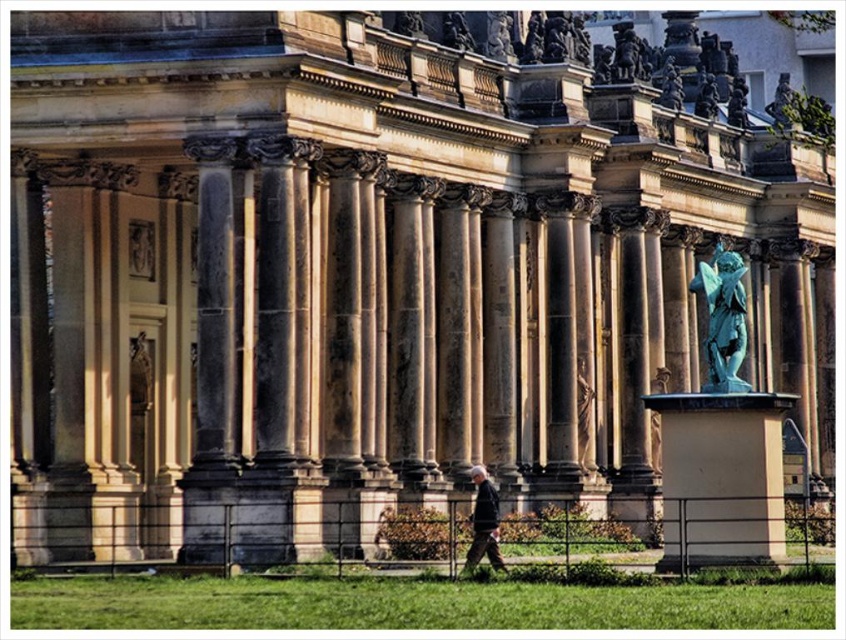
Question: Can you confirm if green patina statue at center-right is positioned to the left of smooth beige statue at center?

Choices:
 (A) no
 (B) yes

Answer: (A)

Question: Considering the real-world distances, which object is closest to the smooth beige statue at center?

Choices:
 (A) green patina statue at upper right
 (B) dark gray fabric jacket at center

Answer: (B)

Question: Is dark gray fabric jacket at center thinner than smooth beige statue at center?

Choices:
 (A) yes
 (B) no

Answer: (B)

Question: Which of the following is the farthest from the observer?

Choices:
 (A) smooth beige statue at center
 (B) dark gray fabric jacket at center
 (C) green patina statue at center-right
 (D) green patina statue at upper right

Answer: (D)

Question: Where is green patina statue at center-right located in relation to dark gray fabric jacket at center in the image?

Choices:
 (A) above
 (B) below

Answer: (A)

Question: Which point is closer to the camera?

Choices:
 (A) (798, 120)
 (B) (479, 547)
 (C) (713, 376)
 (D) (578, 429)

Answer: (B)